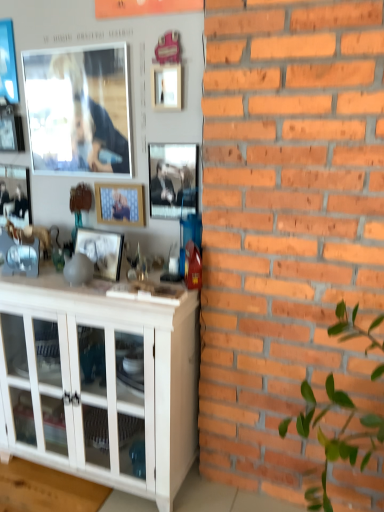
Question: From a real-world perspective, is matte black picture frame at left, which is the second picture frame in left-to-right order, positioned over white glossy cabinet at lower left based on gravity?

Choices:
 (A) yes
 (B) no

Answer: (A)

Question: Considering the relative sizes of matte black picture frame at left, which is the second picture frame in left-to-right order, and white glossy cabinet at lower left in the image provided, is matte black picture frame at left, which is the second picture frame in left-to-right order, shorter than white glossy cabinet at lower left?

Choices:
 (A) no
 (B) yes

Answer: (B)

Question: Is white glossy cabinet at lower left completely or partially inside matte black picture frame at left, which is counted as the 7th picture frame, starting from the right?

Choices:
 (A) yes
 (B) no

Answer: (B)

Question: Is matte black picture frame at left, which is the second picture frame in left-to-right order, not near white glossy cabinet at lower left?

Choices:
 (A) no
 (B) yes

Answer: (A)

Question: Does matte black picture frame at left, which is the second picture frame in left-to-right order, lie in front of white glossy cabinet at lower left?

Choices:
 (A) no
 (B) yes

Answer: (A)

Question: Does point (56, 115) appear closer or farther from the camera than point (6, 91)?

Choices:
 (A) closer
 (B) farther

Answer: (A)

Question: From the image's perspective, is matte glass picture frame at upper left, which appears as the 5th picture frame when viewed from the right, located above or below metallic blue picture frame at upper left, which is the eighth picture frame from right to left?

Choices:
 (A) above
 (B) below

Answer: (B)

Question: In the image, is matte glass picture frame at upper left, which is counted as the 4th picture frame, starting from the left, on the left side or the right side of metallic blue picture frame at upper left, the first picture frame positioned from the left?

Choices:
 (A) left
 (B) right

Answer: (B)

Question: Is matte glass picture frame at upper left, which is counted as the 4th picture frame, starting from the left, inside or outside of metallic blue picture frame at upper left, the first picture frame positioned from the left?

Choices:
 (A) outside
 (B) inside

Answer: (A)

Question: Is wooden frame at center, the 3th picture frame in the right-to-left sequence, taller or shorter than matte glass picture frame at upper left, which appears as the 5th picture frame when viewed from the right?

Choices:
 (A) tall
 (B) short

Answer: (B)

Question: Is wooden frame at center, the 3th picture frame in the right-to-left sequence, spatially inside matte glass picture frame at upper left, which appears as the 5th picture frame when viewed from the right, or outside of it?

Choices:
 (A) outside
 (B) inside

Answer: (A)

Question: Relative to matte glass picture frame at upper left, which is counted as the 4th picture frame, starting from the left, is wooden frame at center, the 3th picture frame in the right-to-left sequence, in front or behind?

Choices:
 (A) front
 (B) behind

Answer: (B)

Question: In the image, is wooden frame at center, the 3th picture frame in the right-to-left sequence, on the left side or the right side of matte glass picture frame at upper left, which is counted as the 4th picture frame, starting from the left?

Choices:
 (A) right
 (B) left

Answer: (A)

Question: Which is correct: metallic silver picture frame at upper left, positioned as the 3th picture frame in left-to-right order, is inside metallic blue picture frame at upper left, which is the eighth picture frame from right to left, or outside of it?

Choices:
 (A) outside
 (B) inside

Answer: (A)

Question: Is metallic silver picture frame at upper left, the sixth picture frame in the right-to-left sequence, taller or shorter than metallic blue picture frame at upper left, which is the eighth picture frame from right to left?

Choices:
 (A) short
 (B) tall

Answer: (A)